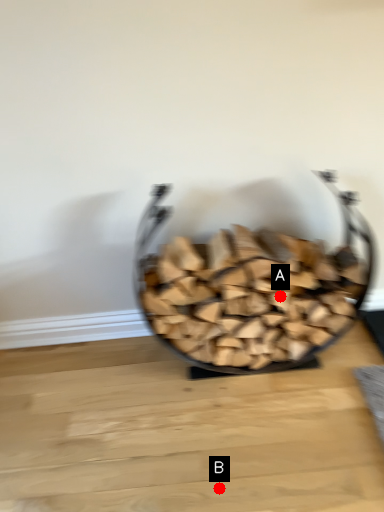
Question: Two points are circled on the image, labeled by A and B beside each circle. Which point is closer to the camera?

Choices:
 (A) A is closer
 (B) B is closer

Answer: (B)